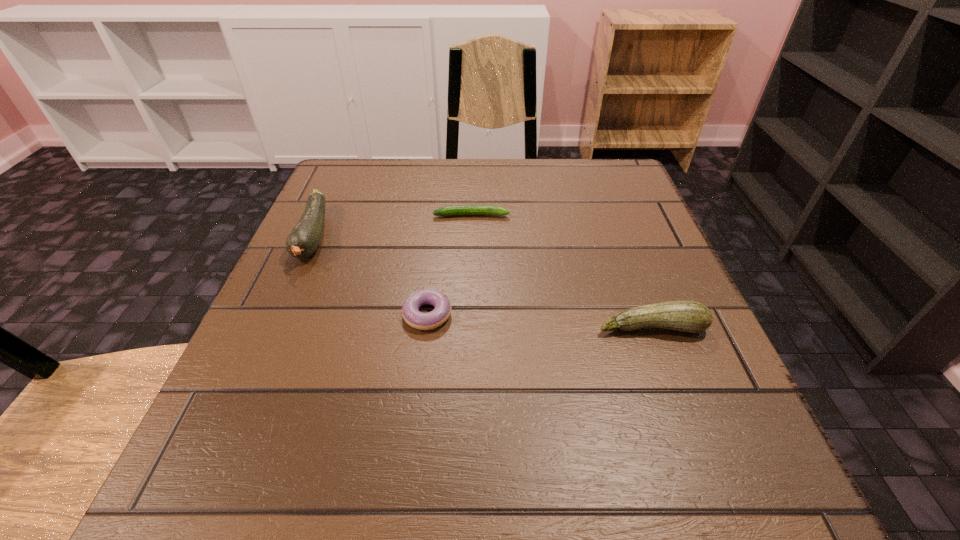
Where is `free space between the doughnut and the rightmost zucchini`? This screenshot has height=540, width=960. free space between the doughnut and the rightmost zucchini is located at coordinates (540, 321).

You are a GUI agent. You are given a task and a screenshot of the screen. Output one action in this format:
    pyautogui.click(x=<x>, y=<y>)
    Task: Click on the free space between the shortest zucchini and the rightmost object
    The width and height of the screenshot is (960, 540).
    Given the screenshot: What is the action you would take?
    pyautogui.click(x=562, y=271)

Identify the location of empty location between the leftmost zucchini and the third tallest object. The width and height of the screenshot is (960, 540). (371, 275).

Locate an element on the screen. This screenshot has width=960, height=540. free space between the leftmost object and the second zucchini from left to right is located at coordinates (393, 226).

What are the coordinates of `empty location between the third tallest object and the leftmost zucchini` in the screenshot? It's located at (371, 275).

Find the location of `empty space that is in between the rightmost zucchini and the leftmost zucchini`. empty space that is in between the rightmost zucchini and the leftmost zucchini is located at coordinates (483, 281).

At what (x,y) coordinates should I click in order to perform the action: click on vacant space that is in between the leftmost zucchini and the shortest zucchini. Please return your answer as a coordinate pair (x, y). Looking at the image, I should click on (393, 226).

Image resolution: width=960 pixels, height=540 pixels. In order to click on free spot between the rightmost object and the second shortest object in this screenshot , I will do `click(540, 321)`.

Identify which object is the third closest to the doughnut. Please provide its 2D coordinates. Your answer should be formatted as a tuple, i.e. [(x, y)], where the tuple contains the x and y coordinates of a point satisfying the conditions above.

[(686, 316)]

Identify which object is located as the third nearest to the leftmost zucchini. Please provide its 2D coordinates. Your answer should be formatted as a tuple, i.e. [(x, y)], where the tuple contains the x and y coordinates of a point satisfying the conditions above.

[(686, 316)]